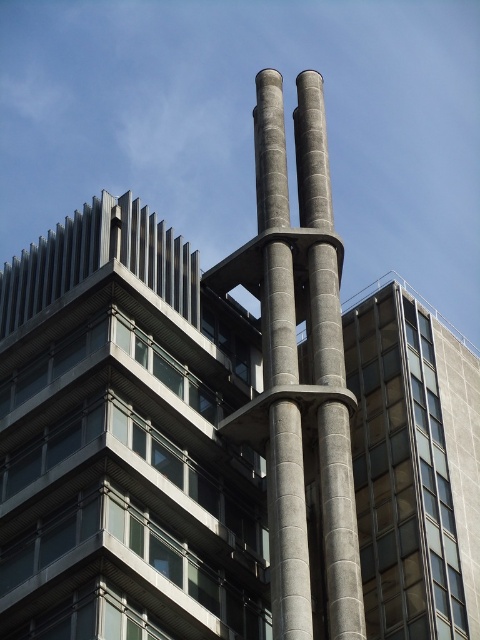
Question: Is gray concrete pillar at center positioned at the back of slate gray concrete pillar at center?

Choices:
 (A) yes
 (B) no

Answer: (B)

Question: Which point is closer to the camera?

Choices:
 (A) [266, 131]
 (B) [297, 147]
 (C) [354, 396]

Answer: (C)

Question: Which is farther from the gray concrete pillar at center?

Choices:
 (A) slate gray concrete pillar at center
 (B) gray concrete pillars at center

Answer: (B)

Question: Does gray concrete pillar at center appear on the left side of gray concrete pillars at center?

Choices:
 (A) yes
 (B) no

Answer: (B)

Question: Where is gray concrete pillar at center located in relation to gray concrete pillars at center in the image?

Choices:
 (A) left
 (B) right

Answer: (B)

Question: Which point appears farthest from the camera in this image?

Choices:
 (A) (273, 417)
 (B) (337, 502)
 (C) (334, 420)

Answer: (A)